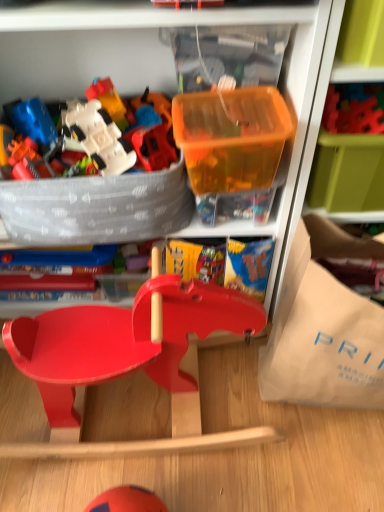
Question: From the image's perspective, is translucent plastic container at upper right under translucent orange plastic container at upper center?

Choices:
 (A) no
 (B) yes

Answer: (A)

Question: From the image's perspective, does translucent plastic container at upper right appear higher than translucent orange plastic container at upper center?

Choices:
 (A) yes
 (B) no

Answer: (A)

Question: Is translucent plastic container at upper right bigger than translucent orange plastic container at upper center?

Choices:
 (A) yes
 (B) no

Answer: (A)

Question: Is translucent orange plastic container at upper center at the back of translucent plastic container at upper right?

Choices:
 (A) no
 (B) yes

Answer: (A)

Question: From a real-world perspective, is translucent plastic container at upper right physically below translucent orange plastic container at upper center?

Choices:
 (A) no
 (B) yes

Answer: (B)

Question: Considering their positions, is white plastic spaceship at upper left, the 1th toy from the left, located in front of or behind smooth plastic toy at center, acting as the 1th toy starting from the top?

Choices:
 (A) behind
 (B) front

Answer: (A)

Question: Is white plastic spaceship at upper left, the 1th toy from the left, wider or thinner than smooth plastic toy at center, which is the 1th toy from right to left?

Choices:
 (A) thin
 (B) wide

Answer: (A)

Question: Considering the positions of white plastic spaceship at upper left, positioned as the 2th toy in right-to-left order, and smooth plastic toy at center, the 2th toy when ordered from bottom to top, in the image, is white plastic spaceship at upper left, positioned as the 2th toy in right-to-left order, bigger or smaller than smooth plastic toy at center, the 2th toy when ordered from bottom to top,?

Choices:
 (A) small
 (B) big

Answer: (A)

Question: Is white plastic spaceship at upper left, acting as the 1th toy starting from the bottom, inside or outside of smooth plastic toy at center, the 2th toy viewed from the left?

Choices:
 (A) inside
 (B) outside

Answer: (B)

Question: Choose the correct answer: Is beige paper bag at right inside smooth plastic toy at center, the 2th toy when ordered from bottom to top, or outside it?

Choices:
 (A) inside
 (B) outside

Answer: (B)

Question: From the image's perspective, relative to smooth plastic toy at center, which is the 1th toy from right to left, is beige paper bag at right above or below?

Choices:
 (A) below
 (B) above

Answer: (A)

Question: Considering the positions of beige paper bag at right and smooth plastic toy at center, acting as the 1th toy starting from the top, in the image, is beige paper bag at right taller or shorter than smooth plastic toy at center, acting as the 1th toy starting from the top,?

Choices:
 (A) short
 (B) tall

Answer: (B)

Question: In terms of width, does beige paper bag at right look wider or thinner when compared to smooth plastic toy at center, acting as the 1th toy starting from the top?

Choices:
 (A) wide
 (B) thin

Answer: (A)

Question: Based on their sizes in the image, would you say smooth red wooden baby carriage at center is bigger or smaller than beige paper bag at right?

Choices:
 (A) big
 (B) small

Answer: (A)

Question: Relative to beige paper bag at right, is smooth red wooden baby carriage at center in front or behind?

Choices:
 (A) behind
 (B) front

Answer: (B)